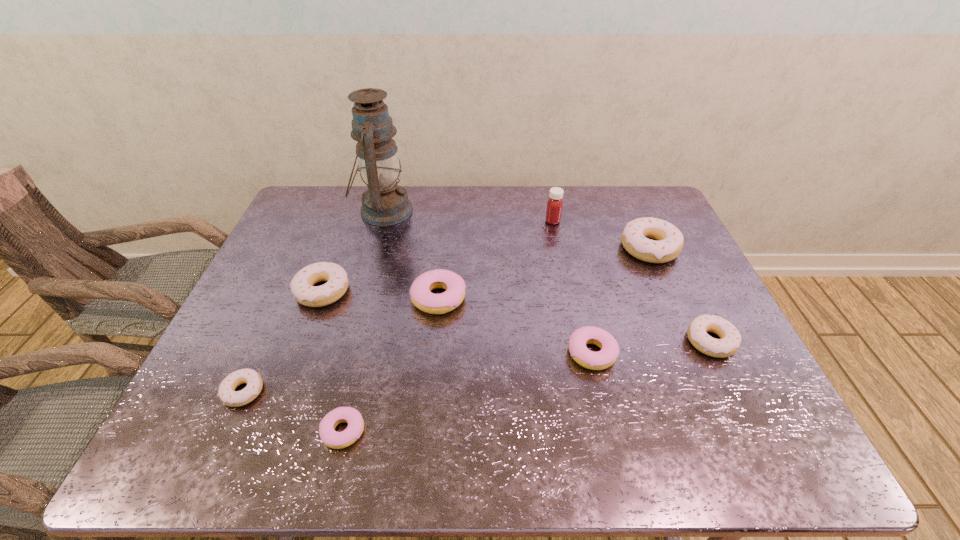
At what (x,y) coordinates should I click in order to perform the action: click on the second closest pink doughnut to the second biggest pink doughnut. Please return your answer as a coordinate pair (x, y). The width and height of the screenshot is (960, 540). Looking at the image, I should click on (331, 438).

In order to click on the closest pink doughnut to the medicine in this screenshot , I will do `click(422, 297)`.

Locate an element on the screen. vacant region that satisfies the following two spatial constraints: 1. on the back side of the second nearest white doughnut; 2. on the left side of the rightmost pink doughnut is located at coordinates (588, 341).